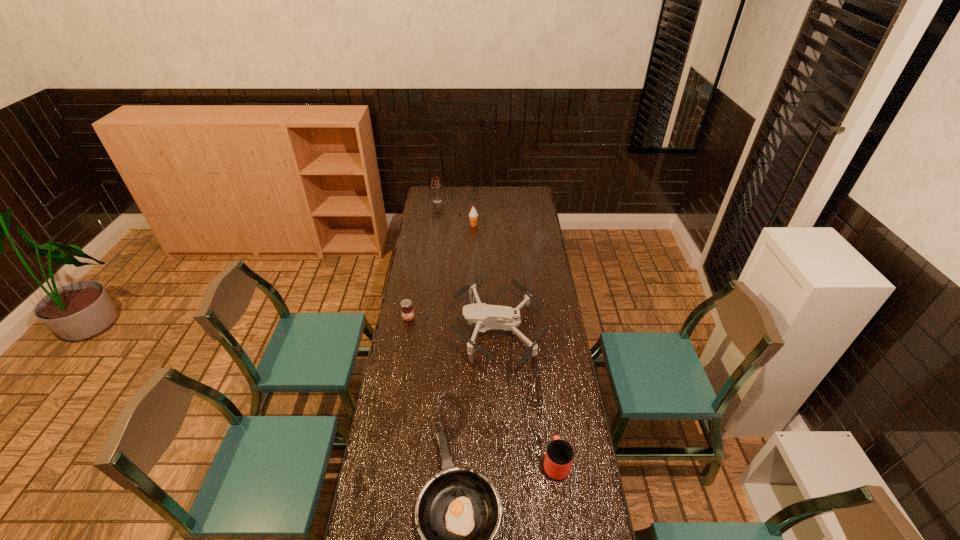
In the image, there is a desktop. Identify the location of vacant space at the far edge. The image size is (960, 540). (447, 202).

You are a GUI agent. You are given a task and a screenshot of the screen. Output one action in this format:
    pyautogui.click(x=<x>, y=<y>)
    Task: Click on the vacant space at the left edge of the desktop
    
    Given the screenshot: What is the action you would take?
    pyautogui.click(x=441, y=250)

In the image, there is a desktop. Where is `vacant region at the right edge`? The width and height of the screenshot is (960, 540). vacant region at the right edge is located at coordinates (553, 271).

The height and width of the screenshot is (540, 960). I want to click on vacant region at the far left corner, so click(x=428, y=193).

Where is `blank region between the jam and the cup`? This screenshot has height=540, width=960. blank region between the jam and the cup is located at coordinates (482, 391).

Identify the location of vacant space that's between the drone and the jam. (454, 324).

Where is `vacant space in between the wineglass and the cup`? The image size is (960, 540). vacant space in between the wineglass and the cup is located at coordinates (496, 332).

Where is `free space between the farthest object and the cup`? free space between the farthest object and the cup is located at coordinates (496, 332).

The image size is (960, 540). Identify the location of vacant area between the cup and the icecream. (515, 344).

The height and width of the screenshot is (540, 960). Identify the location of free spot between the jam and the drone. (454, 324).